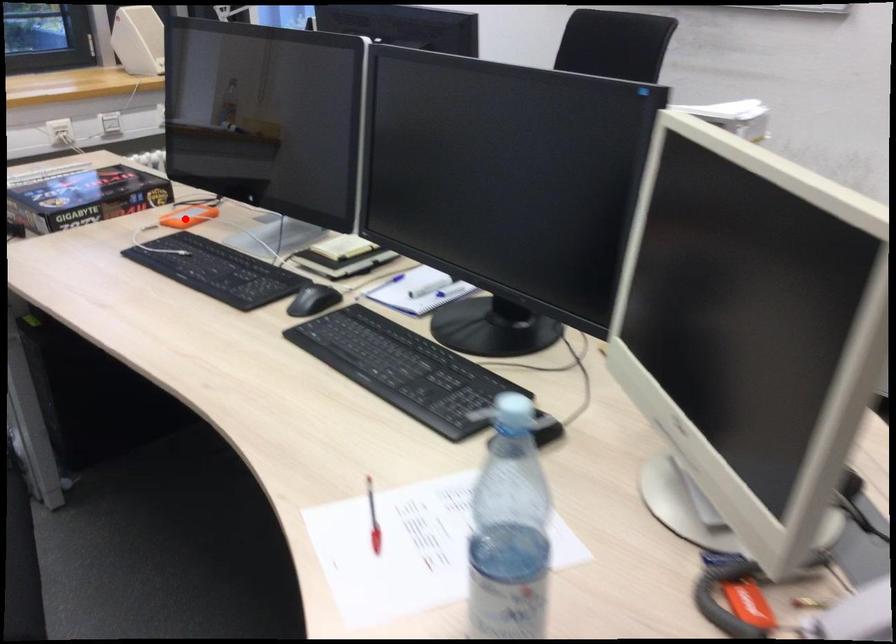
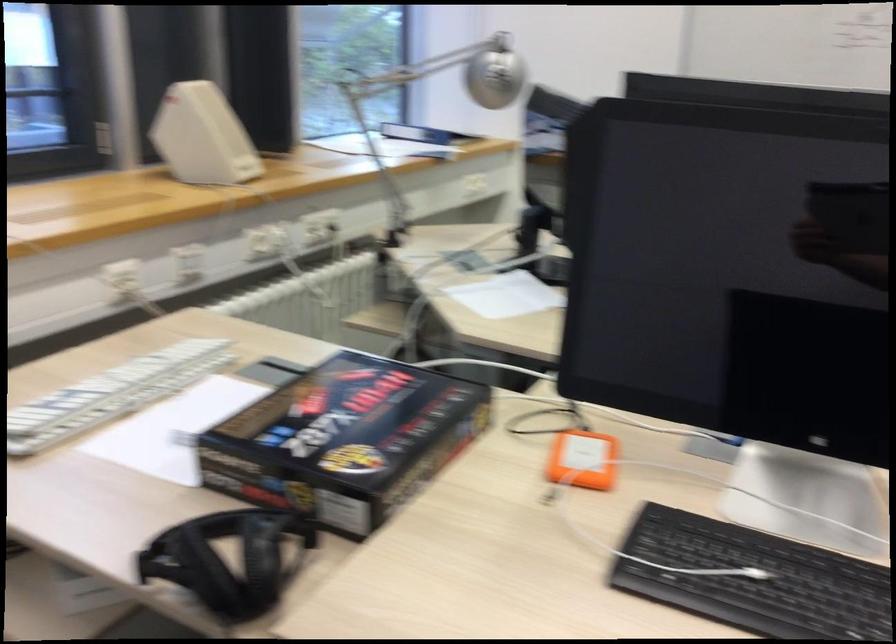
Where in the second image is the point corresponding to the highlighted location from the first image?

(582, 460)